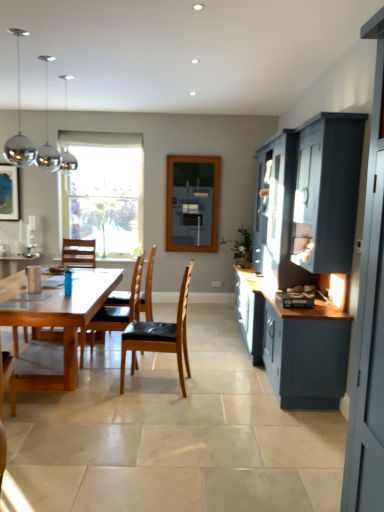
Question: From the image's perspective, does brown leather chair at center, which is the third chair in front-to-back order, appear higher than light brown wooden table at center?

Choices:
 (A) yes
 (B) no

Answer: (A)

Question: Does brown leather chair at center, which is the third chair in front-to-back order, have a larger size compared to light brown wooden table at center?

Choices:
 (A) yes
 (B) no

Answer: (B)

Question: From a real-world perspective, is brown leather chair at center, which is the third chair in front-to-back order, on top of light brown wooden table at center?

Choices:
 (A) no
 (B) yes

Answer: (B)

Question: Can you confirm if brown leather chair at center, arranged as the first chair when viewed from the back, is positioned to the right of light brown wooden table at center?

Choices:
 (A) no
 (B) yes

Answer: (B)

Question: Does brown leather chair at center, which is the third chair in front-to-back order, contain light brown wooden table at center?

Choices:
 (A) no
 (B) yes

Answer: (A)

Question: From the image's perspective, relative to wooden chair with black seat cushion at center, which appears as the 2th chair when viewed from the back, is clear glass window at center above or below?

Choices:
 (A) above
 (B) below

Answer: (A)

Question: In the image, is clear glass window at center positioned in front of or behind wooden chair with black seat cushion at center, which appears as the 2th chair when viewed from the back?

Choices:
 (A) front
 (B) behind

Answer: (B)

Question: Considering the relative positions of clear glass window at center and wooden chair with black seat cushion at center, which appears as the 2th chair when viewed from the back, in the image provided, is clear glass window at center to the left or to the right of wooden chair with black seat cushion at center, which appears as the 2th chair when viewed from the back,?

Choices:
 (A) right
 (B) left

Answer: (B)

Question: From a real-world perspective, relative to wooden chair with black seat cushion at center, arranged as the second chair when viewed from the front, is clear glass window at center vertically above or below?

Choices:
 (A) below
 (B) above

Answer: (B)

Question: In the image, is clear glass window at center positioned in front of or behind satin silver toaster at lower right?

Choices:
 (A) behind
 (B) front

Answer: (A)

Question: Is clear glass window at center spatially inside satin silver toaster at lower right, or outside of it?

Choices:
 (A) inside
 (B) outside

Answer: (B)

Question: From the image's perspective, relative to satin silver toaster at lower right, is clear glass window at center above or below?

Choices:
 (A) below
 (B) above

Answer: (B)

Question: Based on their positions, is clear glass window at center located to the left or right of satin silver toaster at lower right?

Choices:
 (A) left
 (B) right

Answer: (A)

Question: From a real-world perspective, relative to clear glass window at center, is brown leather chair at center, arranged as the first chair when viewed from the back, vertically above or below?

Choices:
 (A) above
 (B) below

Answer: (B)

Question: In terms of width, does brown leather chair at center, arranged as the first chair when viewed from the back, look wider or thinner when compared to clear glass window at center?

Choices:
 (A) thin
 (B) wide

Answer: (B)